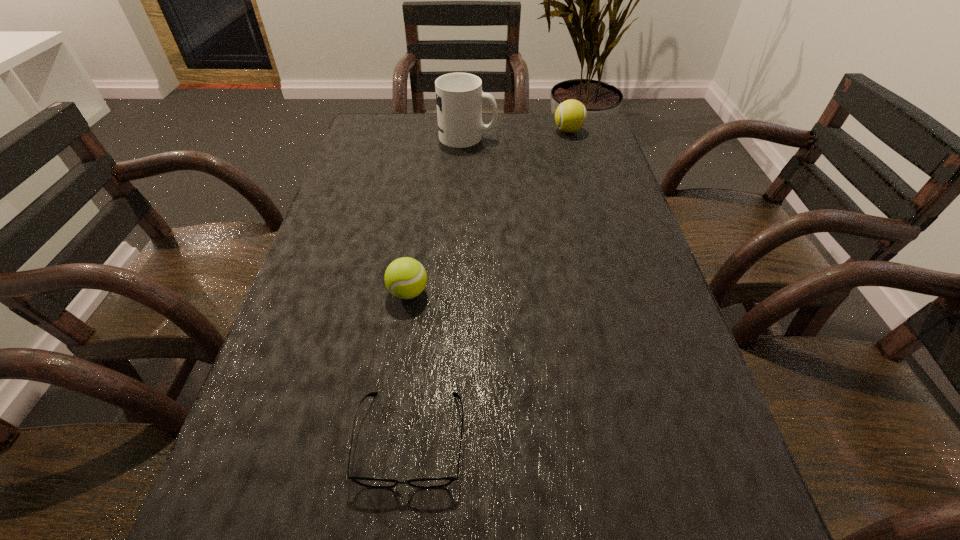
This screenshot has height=540, width=960. What are the coordinates of `mug` in the screenshot? It's located at (459, 96).

Image resolution: width=960 pixels, height=540 pixels. I want to click on the rightmost object, so click(570, 116).

In order to click on the right tennis ball in this screenshot , I will do `click(570, 116)`.

Locate an element on the screen. the left tennis ball is located at coordinates (405, 278).

At what (x,y) coordinates should I click in order to perform the action: click on the second nearest object. Please return your answer as a coordinate pair (x, y). Looking at the image, I should click on (405, 278).

The height and width of the screenshot is (540, 960). Identify the location of the nearest object. (438, 482).

This screenshot has width=960, height=540. I want to click on the shortest object, so click(x=438, y=482).

Image resolution: width=960 pixels, height=540 pixels. I want to click on vacant area located on the handle side of the tallest object, so click(605, 137).

Locate an element on the screen. Image resolution: width=960 pixels, height=540 pixels. free space located 0.220m on the front of the right tennis ball is located at coordinates (583, 181).

This screenshot has width=960, height=540. In order to click on vacant position located on the back of the nearer tennis ball in this screenshot , I will do `click(426, 174)`.